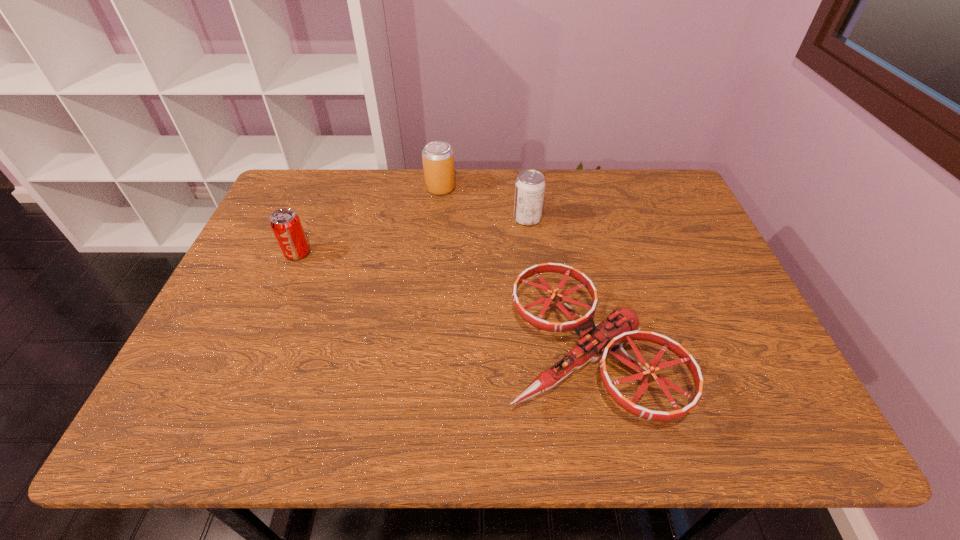
The width and height of the screenshot is (960, 540). Identify the location of object that is the third nearest to the nearest soda can. (530, 185).

Find the location of a particular element. This screenshot has width=960, height=540. soda can that is the closest to the second soda can from right to left is located at coordinates (x=530, y=185).

Locate an element on the screen. soda can identified as the second closest to the farthest soda can is located at coordinates (285, 223).

Where is `vacant area in the image that satisfies the following two spatial constraints: 1. on the front side of the shortest object; 2. on the left side of the farthest soda can`? Image resolution: width=960 pixels, height=540 pixels. vacant area in the image that satisfies the following two spatial constraints: 1. on the front side of the shortest object; 2. on the left side of the farthest soda can is located at coordinates (422, 355).

At what (x,y) coordinates should I click in order to perform the action: click on vacant space that satisfies the following two spatial constraints: 1. on the back side of the farthest soda can; 2. on the right side of the third farthest object. Please return your answer as a coordinate pair (x, y). This screenshot has height=540, width=960. Looking at the image, I should click on point(325,188).

The image size is (960, 540). Identify the location of free space that satisfies the following two spatial constraints: 1. on the back side of the second nearest object; 2. on the right side of the farthest soda can. (325, 188).